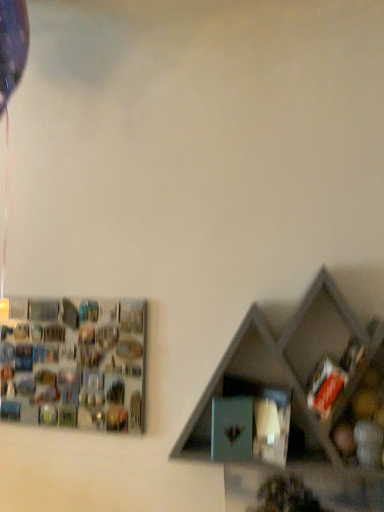
Question: Is matte gray shelf at lower right, which appears as the second shelf when viewed from the back, to the left or to the right of metallic silver frame at upper left, placed as the 2th shelf when sorted from front to back, in the image?

Choices:
 (A) right
 (B) left

Answer: (A)

Question: Looking at their shapes, would you say matte gray shelf at lower right, arranged as the 1th shelf when viewed from the right, is wider or thinner than metallic silver frame at upper left, placed as the 2th shelf when sorted from front to back?

Choices:
 (A) wide
 (B) thin

Answer: (A)

Question: From the image's perspective, is matte gray shelf at lower right, which is the second shelf from left to right, positioned above or below metallic silver frame at upper left, which is the 1th shelf from left to right?

Choices:
 (A) above
 (B) below

Answer: (A)

Question: Is metallic silver frame at upper left, the 1th shelf from the back, in front of or behind matte gray shelf at lower right, arranged as the 1th shelf when viewed from the right, in the image?

Choices:
 (A) behind
 (B) front

Answer: (A)

Question: From their relative heights in the image, would you say metallic silver frame at upper left, placed as the 2th shelf when sorted from front to back, is taller or shorter than matte gray shelf at lower right, which is the second shelf from left to right?

Choices:
 (A) short
 (B) tall

Answer: (A)

Question: Looking at their shapes, would you say metallic silver frame at upper left, the 1th shelf from the back, is wider or thinner than matte gray shelf at lower right, the 1th shelf when ordered from front to back?

Choices:
 (A) thin
 (B) wide

Answer: (A)

Question: Is metallic silver frame at upper left, placed as the 2th shelf when sorted from front to back, inside the boundaries of matte gray shelf at lower right, which is the second shelf from left to right, or outside?

Choices:
 (A) outside
 (B) inside

Answer: (A)